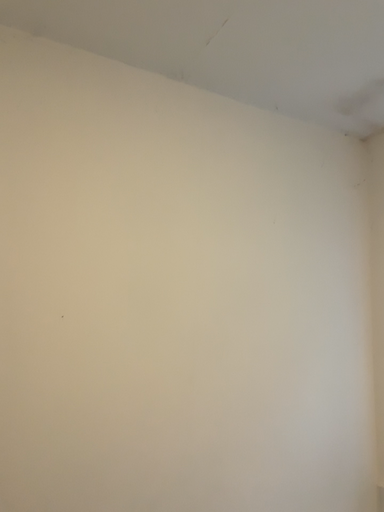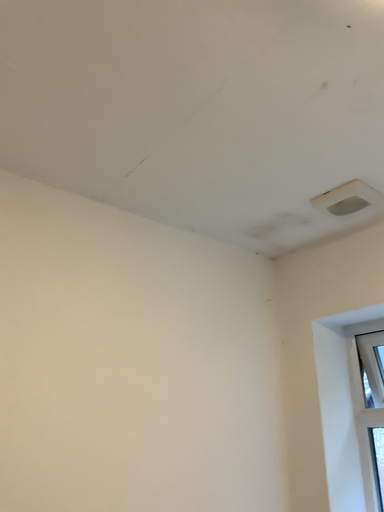
Question: Which way did the camera rotate in the video?

Choices:
 (A) rotated downward
 (B) rotated upward

Answer: (B)